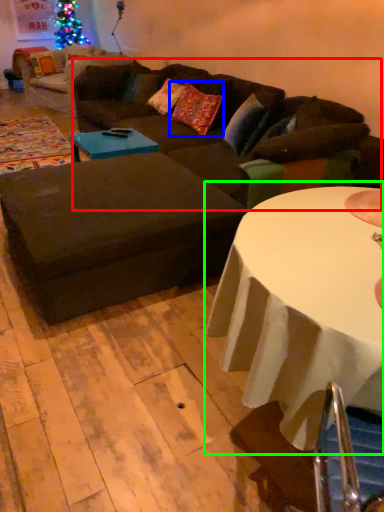
Question: Which object is positioned farthest from couch (highlighted by a red box)? Select from pillow (highlighted by a blue box) and table (highlighted by a green box).

Choices:
 (A) pillow
 (B) table

Answer: (B)